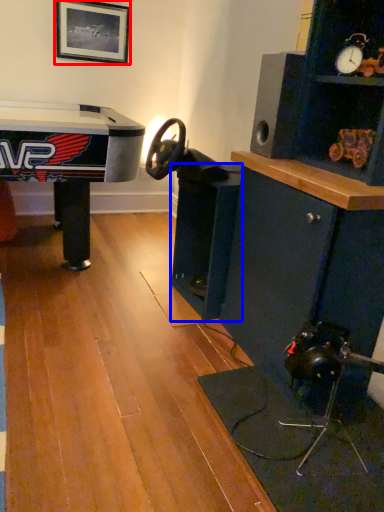
Question: Which of the following is the farthest to the observer, picture frame (highlighted by a red box) or shelf (highlighted by a blue box)?

Choices:
 (A) picture frame
 (B) shelf

Answer: (A)